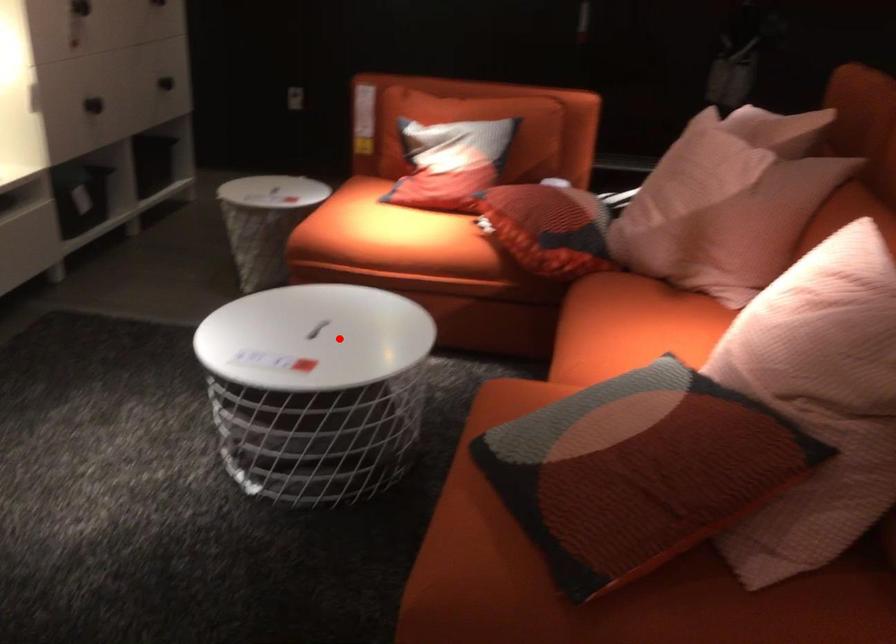
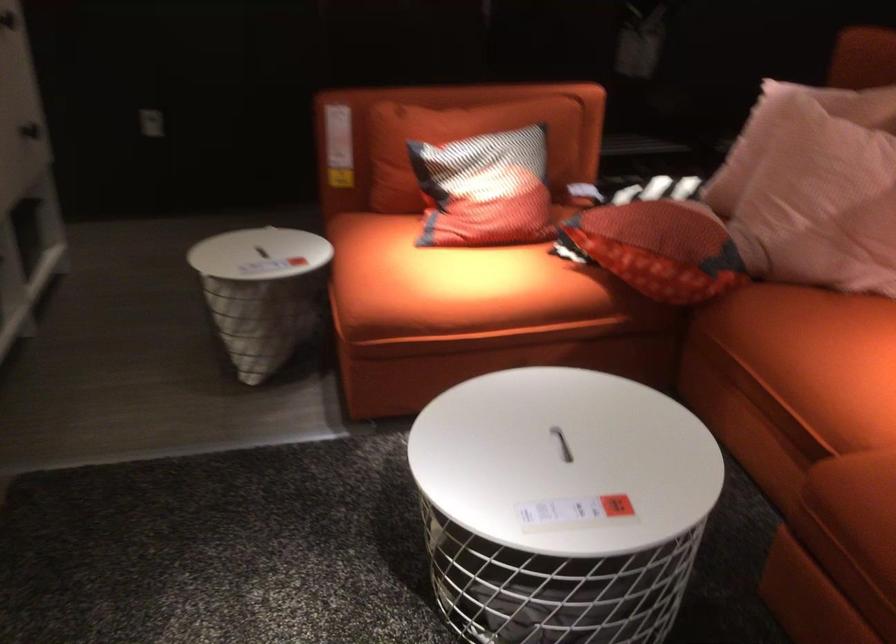
Locate, in the second image, the point that corresponds to the highlighted location in the first image.

(562, 444)